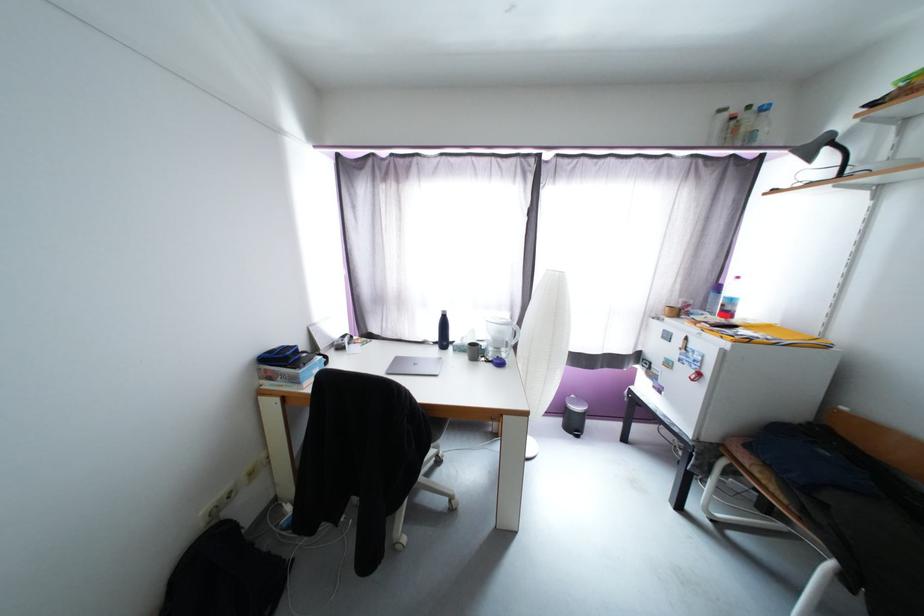
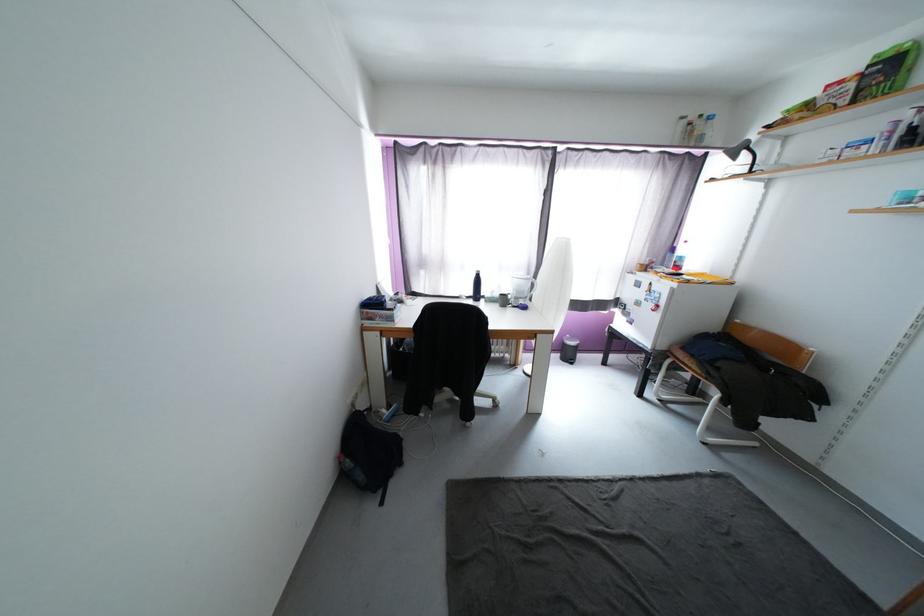
The point at (832, 151) is marked in the first image. Where is the corresponding point in the second image?

(749, 154)